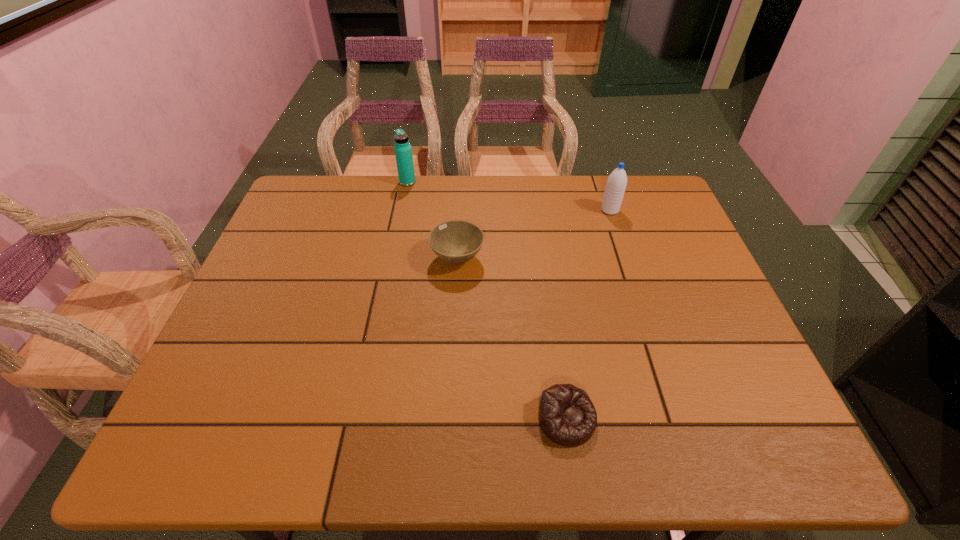
Identify the location of vacant space that's between the bowl and the third nearest object. (534, 234).

Identify the location of blank region between the leftmost object and the beanbag. This screenshot has width=960, height=540. (487, 300).

Locate an element on the screen. vacant point located between the left water bottle and the third nearest object is located at coordinates (509, 196).

The height and width of the screenshot is (540, 960). I want to click on free area in between the rightmost object and the nearest object, so click(588, 315).

I want to click on vacant area that lies between the farther water bottle and the nearer water bottle, so click(x=509, y=196).

At what (x,y) coordinates should I click in order to perform the action: click on free space between the third object from right to left and the nearer water bottle. Please return your answer as a coordinate pair (x, y). This screenshot has height=540, width=960. Looking at the image, I should click on click(534, 234).

Locate an element on the screen. free point between the bowl and the left water bottle is located at coordinates (432, 220).

Locate an element on the screen. free point between the third farthest object and the beanbag is located at coordinates (512, 339).

You are a GUI agent. You are given a task and a screenshot of the screen. Output one action in this format:
    pyautogui.click(x=<x>, y=<y>)
    Task: Click on the vacant space that is in between the third nearest object and the third farthest object
    This screenshot has height=540, width=960.
    Given the screenshot: What is the action you would take?
    pyautogui.click(x=534, y=234)

Identify the location of object that is the second closest to the leftmost object. The width and height of the screenshot is (960, 540). click(616, 184).